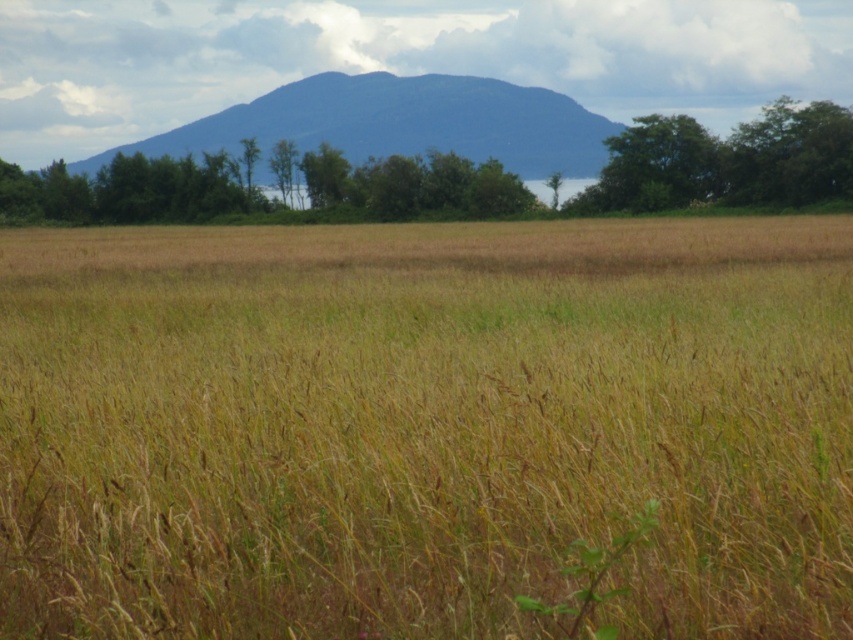
Question: Is blue-green textured mountain at upper center below green leafy tree at upper right?

Choices:
 (A) yes
 (B) no

Answer: (B)

Question: Is brown grass at center smaller than green leafy tree at upper right?

Choices:
 (A) yes
 (B) no

Answer: (B)

Question: Which of the following is the farthest from the observer?

Choices:
 (A) green leafy tree at upper right
 (B) brown grass at center
 (C) blue-green textured mountain at upper center

Answer: (C)

Question: Among these points, which one is farthest from the camera?

Choices:
 (A) (622, 163)
 (B) (730, 532)

Answer: (A)

Question: Is brown grass at center to the left of green leafy tree at upper right from the viewer's perspective?

Choices:
 (A) no
 (B) yes

Answer: (B)

Question: Estimate the real-world distances between objects in this image. Which object is farther from the green leafy tree at upper right?

Choices:
 (A) blue-green textured mountain at upper center
 (B) brown grass at center

Answer: (B)